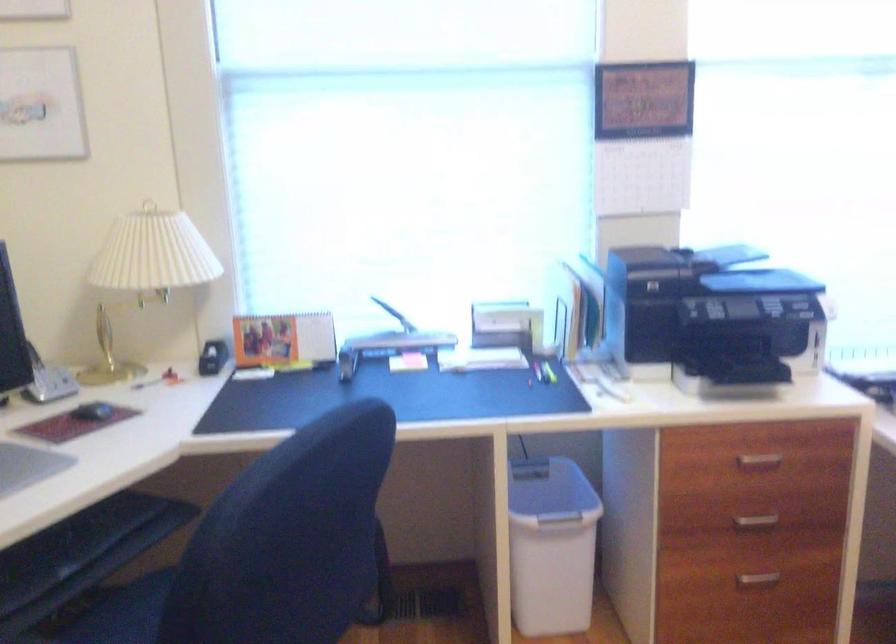
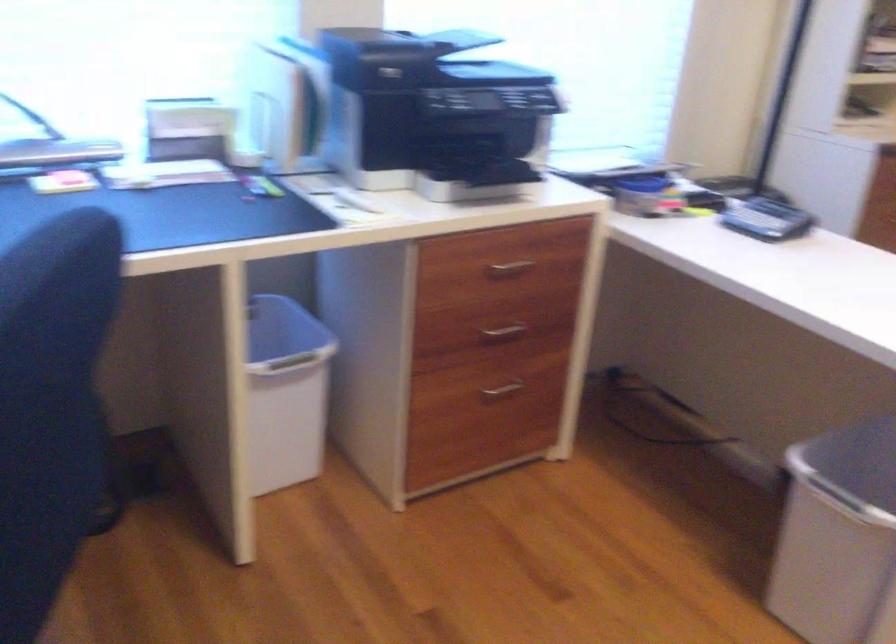
Find the pixel in the second image that matches (571,491) in the first image.

(281, 328)